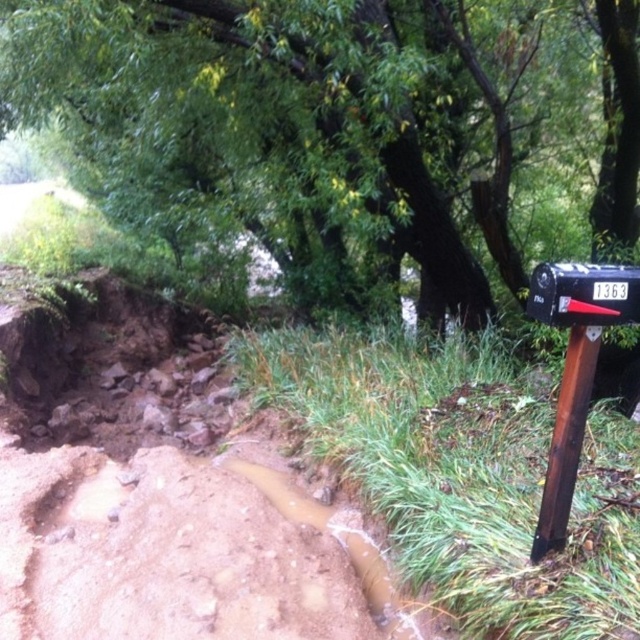
Who is more distant from viewer, (12, 90) or (586, 371)?

The point (12, 90) is behind.

Is point (182, 52) more distant than point (538, 518)?

That is True.

At what (x,y) coordinates should I click in order to perform the action: click on green leafy tree at upper center. Please return your answer as a coordinate pair (x, y). The height and width of the screenshot is (640, 640). Looking at the image, I should click on (280, 124).